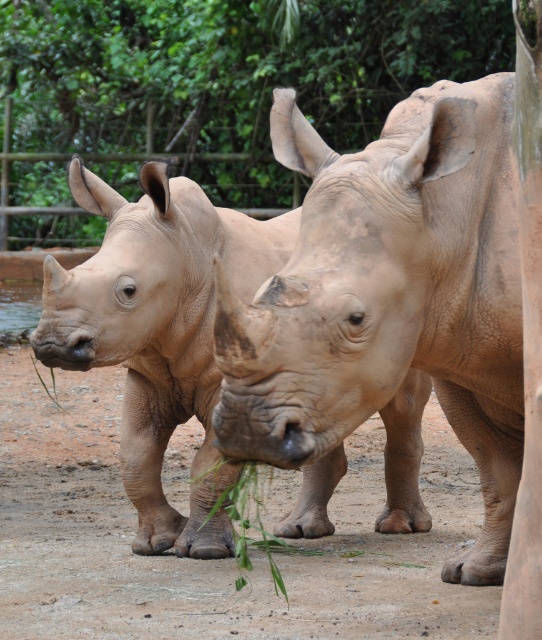
Question: Which point is farther from the camera taking this photo?

Choices:
 (A) (358, 400)
 (B) (236, 580)
 (C) (62, 406)
 (D) (2, 35)

Answer: (D)

Question: Is green leafy plant at center behind green leafy plant at lower left?

Choices:
 (A) no
 (B) yes

Answer: (A)

Question: Can you confirm if green leafy plant at center is positioned to the right of green leafy plant at lower left?

Choices:
 (A) no
 (B) yes

Answer: (B)

Question: Among these objects, which one is nearest to the camera?

Choices:
 (A) green leafy tree at center
 (B) matte brown rhinoceros at center
 (C) green leafy plant at lower left

Answer: (B)

Question: Does matte brown rhinoceros at center have a greater width compared to dull gray rhinoceros at center?

Choices:
 (A) no
 (B) yes

Answer: (B)

Question: Which point is closer to the camera taking this photo?

Choices:
 (A) 63,225
 (B) 61,406

Answer: (B)